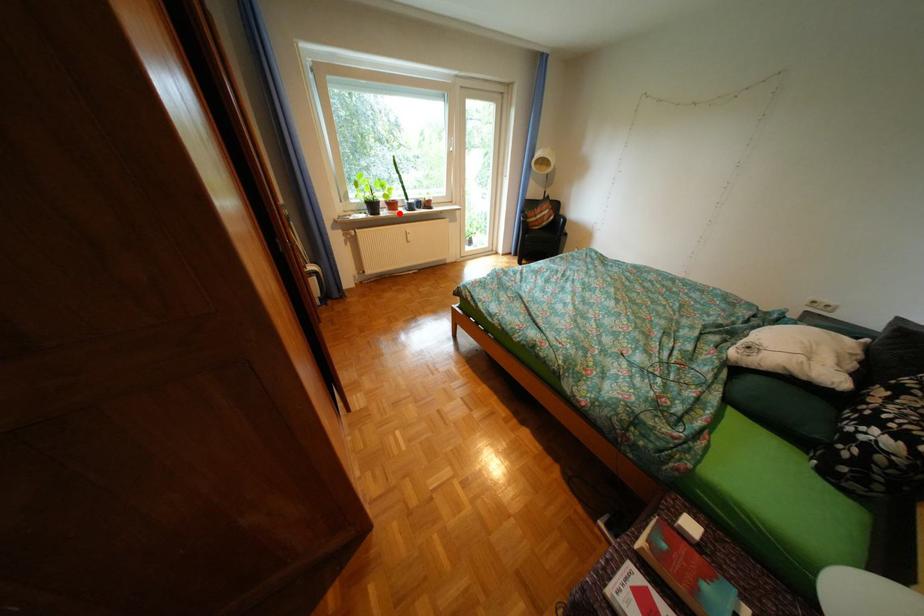
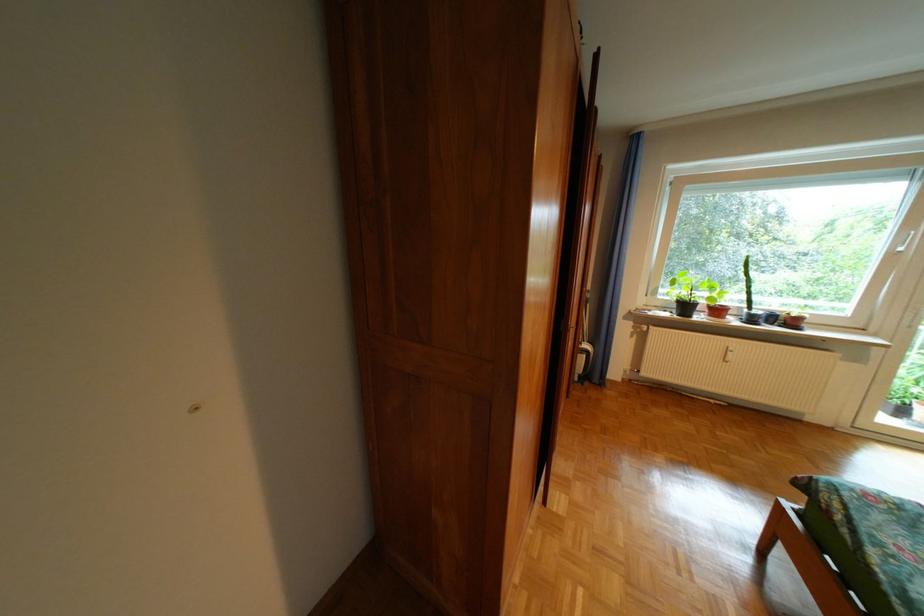
Question: I am providing you with two images of the same scene from different viewpoints. Given a red point in image1, look at the same physical point in image2. Is it:

Choices:
 (A) Closer to the viewpoint
 (B) Farther from the viewpoint

Answer: (B)